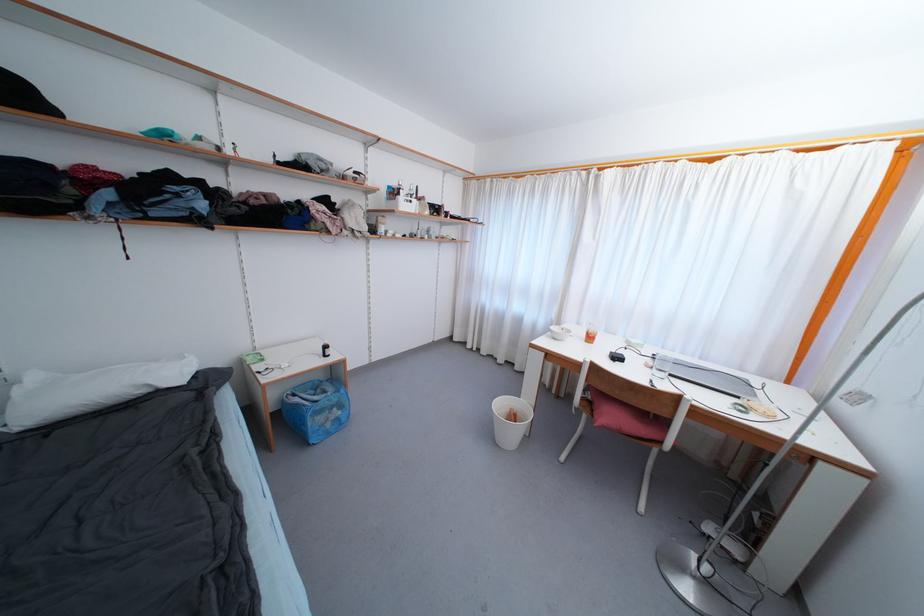
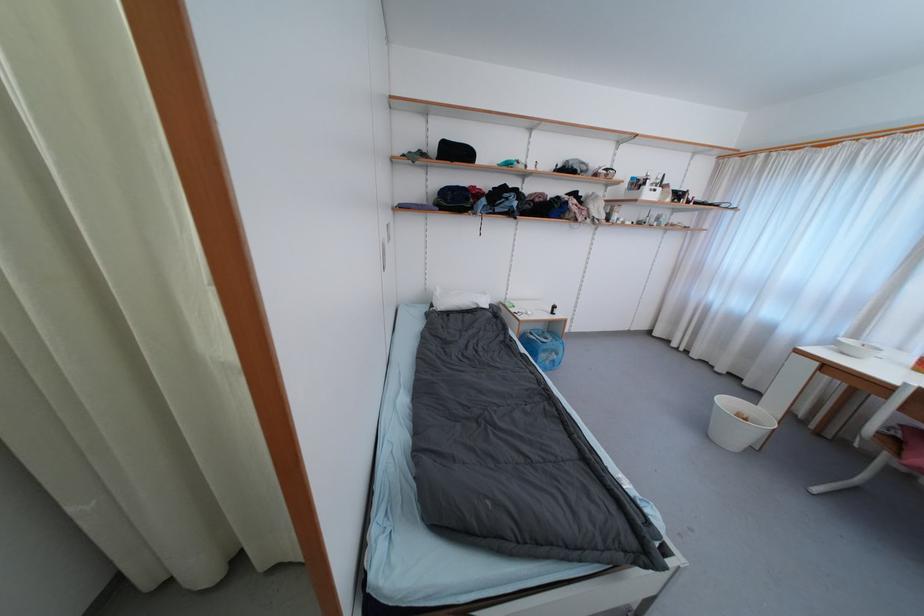
Where in the second image is the point corresponding to (333,354) from the first image?

(560, 313)